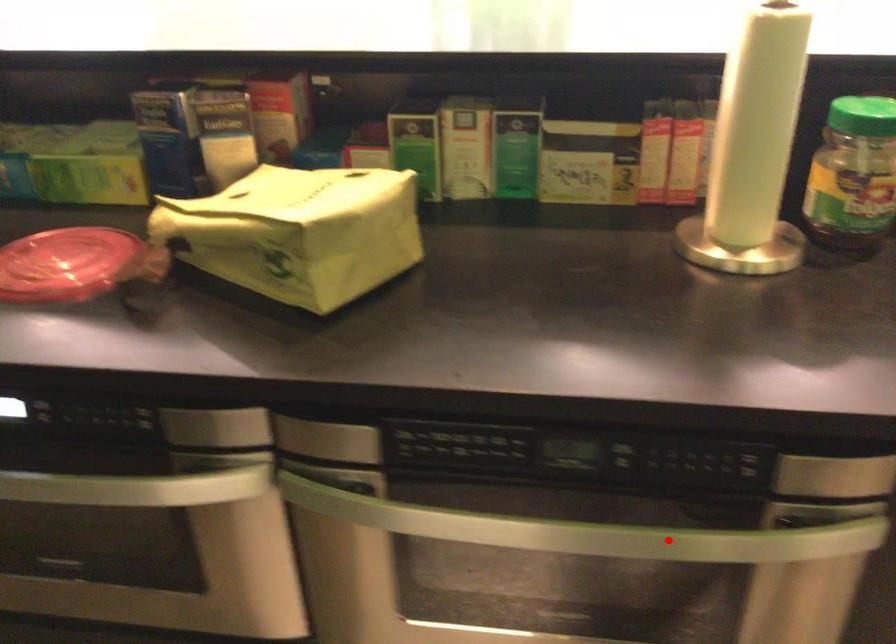
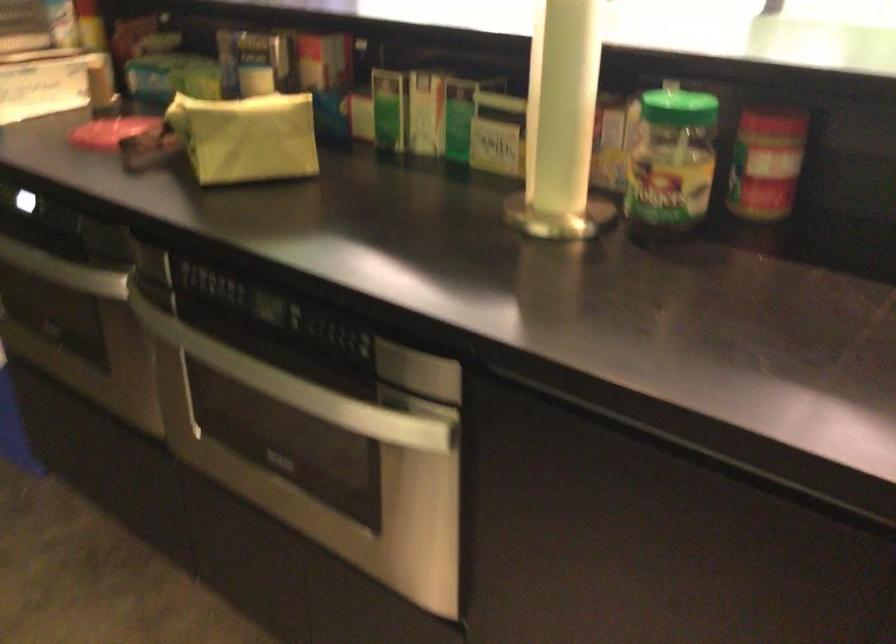
The point at the highlighted location is marked in the first image. Where is the corresponding point in the second image?

(297, 386)